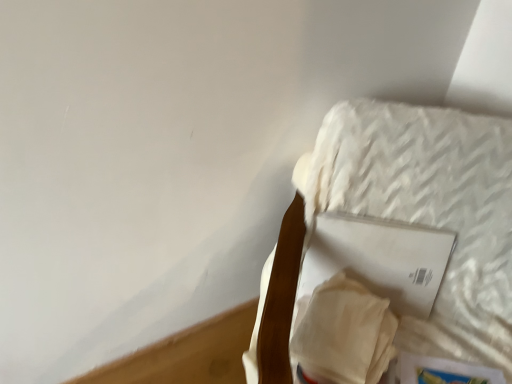
Question: In the image, is white textured mattress at upper right on the left side or the right side of white matte paper at upper right, the 2th paperback book when ordered from bottom to top?

Choices:
 (A) right
 (B) left

Answer: (A)

Question: Looking at the image, does white textured mattress at upper right seem bigger or smaller compared to white matte paper at upper right, the 2th paperback book when ordered from bottom to top?

Choices:
 (A) big
 (B) small

Answer: (A)

Question: Estimate the real-world distances between objects in this image. Which object is farther from the white textured mattress at upper right?

Choices:
 (A) hardcover book at lower right, positioned as the first paperback book in bottom-to-top order
 (B) white matte paper at upper right, the 2th paperback book when ordered from bottom to top

Answer: (A)

Question: Considering the real-world distances, which object is farthest from the white textured mattress at upper right?

Choices:
 (A) white matte paper at upper right, which is the first paperback book from top to bottom
 (B) hardcover book at lower right, which is counted as the second paperback book, starting from the top

Answer: (B)